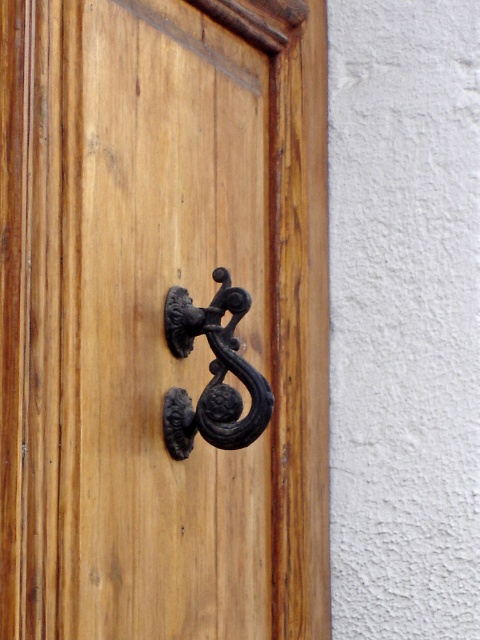
You are trying to open the door but can only reach items that are closer to you. Which one can you use between the matte black knocker at center and the black wrought iron door handle at center?

The matte black knocker at center is closer to the viewer than the black wrought iron door handle at center, so you can reach and use the matte black knocker at center.

You are trying to determine which object is wider between the matte black knocker at center and the black wrought iron door handle at center on the wooden door. Based on the description provided, which one is wider?

The matte black knocker at center is wider than the black wrought iron door handle at center according to the description.